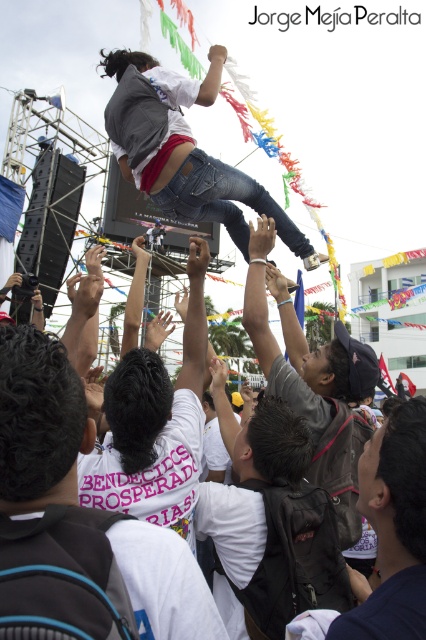
Question: Observing the image, what is the correct spatial positioning of dark blue shirt at lower right in reference to dark gray leather jacket at center?

Choices:
 (A) right
 (B) left

Answer: (A)

Question: Is white t-shirt at center thinner than white cotton shirt at center?

Choices:
 (A) no
 (B) yes

Answer: (A)

Question: Which object appears farthest from the camera in this image?

Choices:
 (A) jeans at center
 (B) dark blue shirt at lower right
 (C) white t-shirt at center

Answer: (A)

Question: Which of the following is the farthest from the observer?

Choices:
 (A) (54, 390)
 (B) (317, 394)

Answer: (B)

Question: Which point is closer to the camera taking this photo?

Choices:
 (A) (250, 180)
 (B) (198, 484)
 (C) (83, 560)
 (D) (333, 369)

Answer: (C)

Question: Is white cotton shirt at center smaller than jeans at center?

Choices:
 (A) yes
 (B) no

Answer: (A)